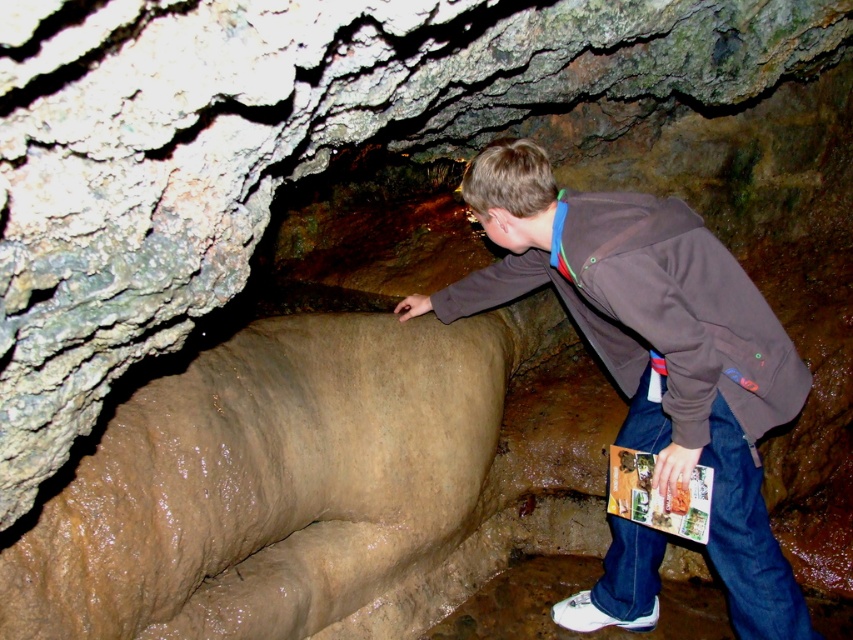
Can you confirm if brown cotton hoodie at center is bigger than brown cotton jacket at center?

Yes, brown cotton hoodie at center is bigger than brown cotton jacket at center.

Which is above, brown cotton hoodie at center or brown cotton jacket at center?

Positioned higher is brown cotton jacket at center.

Describe the element at coordinates (654, 348) in the screenshot. I see `brown cotton hoodie at center` at that location.

The image size is (853, 640). I want to click on brown cotton hoodie at center, so click(x=654, y=348).